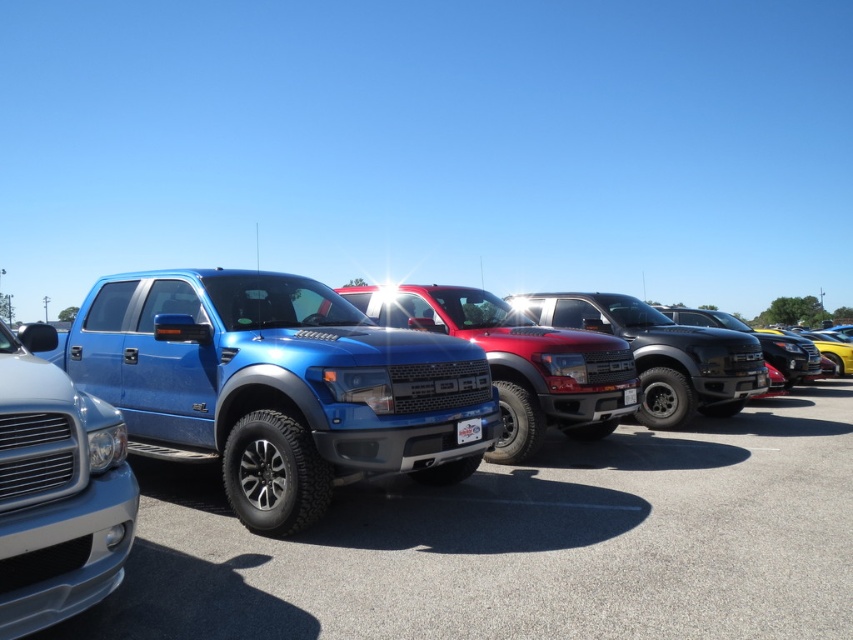
In the scene shown: Can you confirm if metallic blue pickup truck at center is wider than shiny red truck at center?

Indeed, metallic blue pickup truck at center has a greater width compared to shiny red truck at center.

Describe the element at coordinates (277, 387) in the screenshot. I see `metallic blue pickup truck at center` at that location.

Identify the location of metallic blue pickup truck at center. The width and height of the screenshot is (853, 640). (277, 387).

Does satin silver truck at center appear under shiny red truck at center?

Correct, satin silver truck at center is located below shiny red truck at center.

Between satin silver truck at center and shiny red truck at center, which one appears on the right side from the viewer's perspective?

Positioned to the right is shiny red truck at center.

The height and width of the screenshot is (640, 853). What are the coordinates of `satin silver truck at center` in the screenshot? It's located at (57, 490).

Where is `satin silver truck at center`? This screenshot has height=640, width=853. satin silver truck at center is located at coordinates (57, 490).

Is point (782, 524) farther from camera compared to point (573, 355)?

No.

Is point (717, 612) positioned before point (401, 300)?

Yes, it is.

Measure the distance between point (809,396) and camera.

Point (809,396) and camera are 12.10 meters apart from each other.

The width and height of the screenshot is (853, 640). What are the coordinates of `brushed metal truck at center` in the screenshot? It's located at (524, 545).